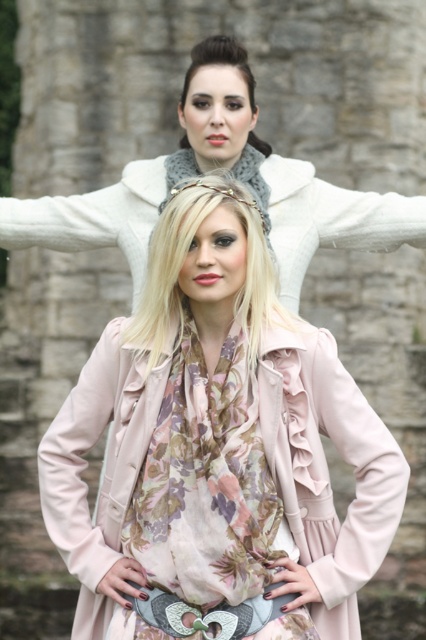
You are standing at the camera position and want to pick up the matte white scarf at upper center. Can you reach it without moving your feet?

The matte white scarf at upper center is 191.47 feet away from the camera, so you cannot reach it without moving your feet.

You are an observer standing in front of the two people in the image. You notice the pink fabric coat at center and the matte white scarf at upper center. Which of these items is located to the right of the other?

The pink fabric coat at center is positioned on the right side of matte white scarf at upper center.